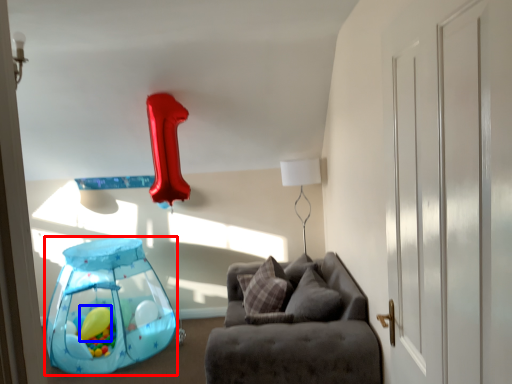
Question: Which object appears farthest to the camera in this image, balloon (highlighted by a red box) or balloon (highlighted by a blue box)?

Choices:
 (A) balloon
 (B) balloon

Answer: (B)